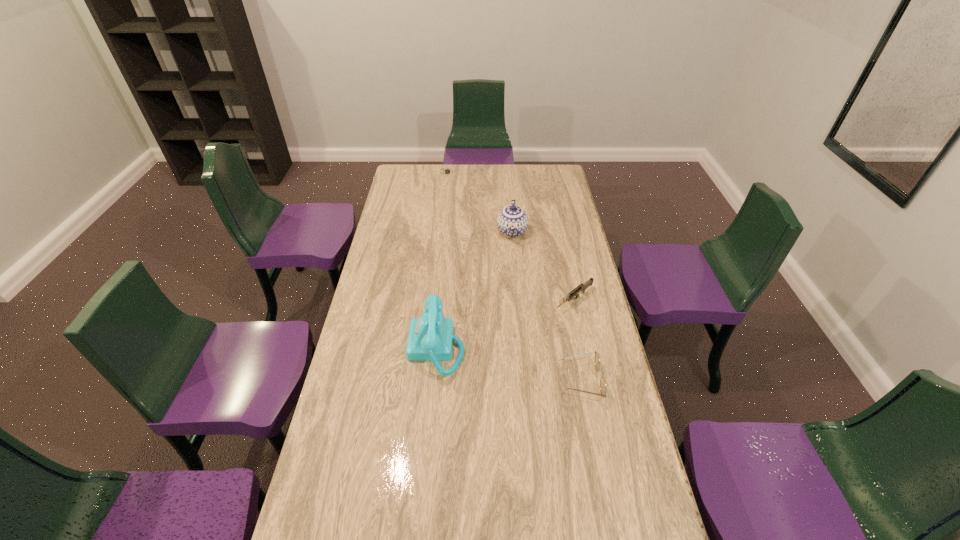
Locate an element on the screen. free space located 0.200m at the spout of the third object from left to right is located at coordinates (512, 279).

At what (x,y) coordinates should I click in order to perform the action: click on vacant point located at the spout of the third object from left to right. Please return your answer as a coordinate pair (x, y). The width and height of the screenshot is (960, 540). Looking at the image, I should click on (512, 269).

I want to click on object positioned at the far edge, so click(x=447, y=171).

Identify the location of spectacles situated at the right edge. The image size is (960, 540). (597, 359).

Image resolution: width=960 pixels, height=540 pixels. Find the location of `gun that is at the right edge`. gun that is at the right edge is located at coordinates pyautogui.click(x=582, y=287).

In the image, there is a desktop. Where is `vacant space at the far edge`? vacant space at the far edge is located at coordinates (508, 177).

Where is `free space at the near edge of the desktop`? The image size is (960, 540). free space at the near edge of the desktop is located at coordinates (568, 511).

Identify the location of vacant position at the left edge of the desktop. (375, 286).

In the image, there is a desktop. Identify the location of vacant area at the right edge. The image size is (960, 540). (588, 458).

The height and width of the screenshot is (540, 960). What are the coordinates of `free space at the far right corner of the desktop` in the screenshot? It's located at (552, 179).